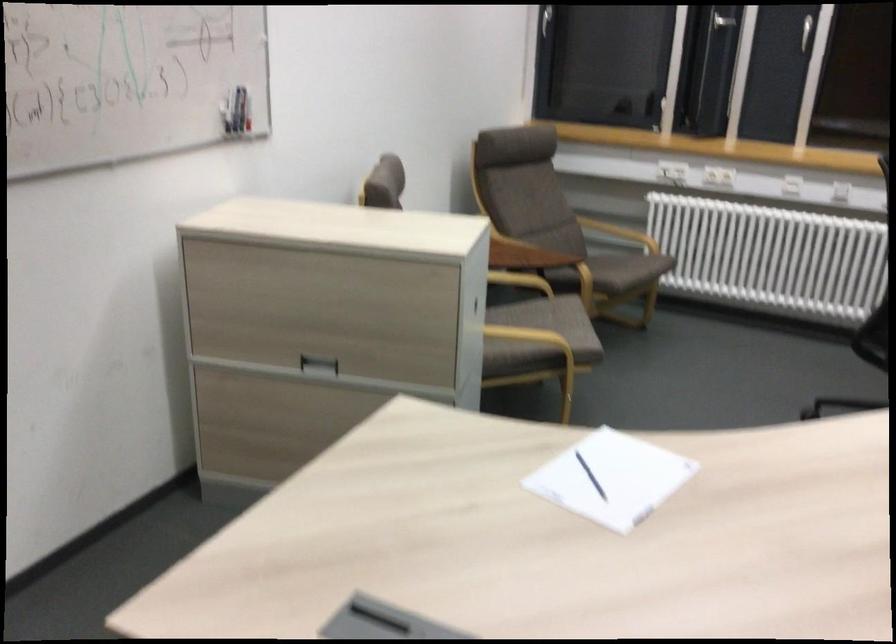
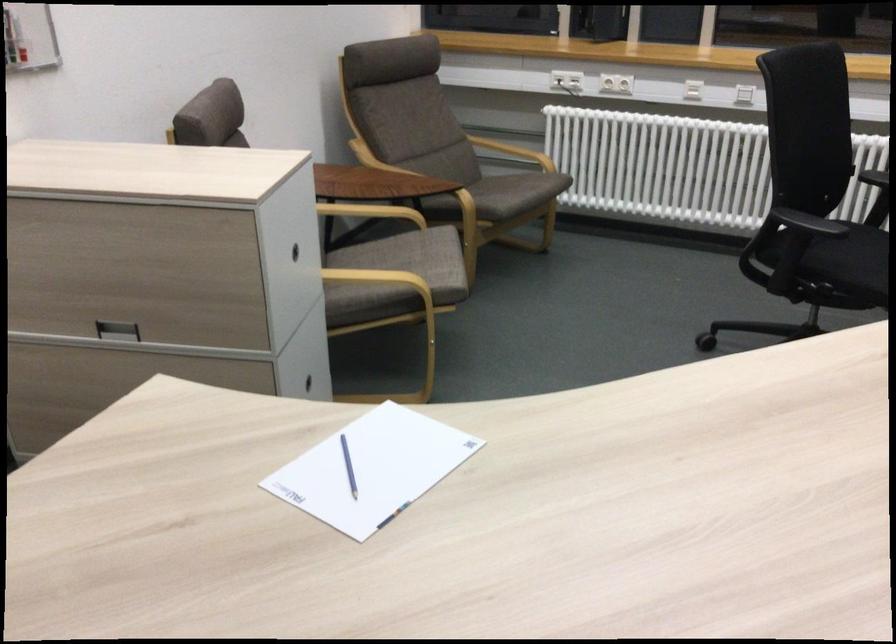
Locate, in the second image, the point that corresponds to the point at 625,265 in the first image.

(510, 191)